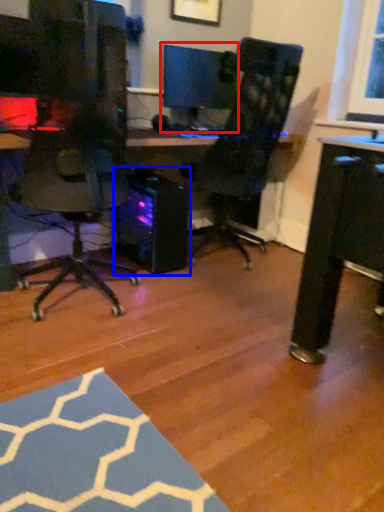
Question: Which object appears farthest to the camera in this image, computer monitor (highlighted by a red box) or computer tower (highlighted by a blue box)?

Choices:
 (A) computer monitor
 (B) computer tower

Answer: (A)